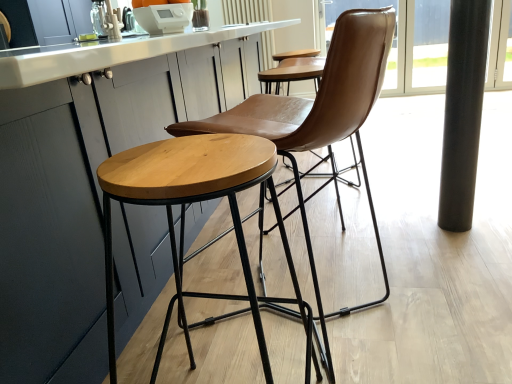
Question: Does brown leather chair at center come behind black polished pole at right?

Choices:
 (A) no
 (B) yes

Answer: (A)

Question: Does brown leather chair at center have a greater height compared to black polished pole at right?

Choices:
 (A) no
 (B) yes

Answer: (A)

Question: Does brown leather chair at center have a smaller size compared to black polished pole at right?

Choices:
 (A) no
 (B) yes

Answer: (A)

Question: Does brown leather chair at center have a larger size compared to black polished pole at right?

Choices:
 (A) yes
 (B) no

Answer: (A)

Question: From the image's perspective, is brown leather chair at center located beneath black polished pole at right?

Choices:
 (A) yes
 (B) no

Answer: (A)

Question: Is brown leather chair at center wider than black polished pole at right?

Choices:
 (A) yes
 (B) no

Answer: (A)

Question: Is white glossy countertop at center facing towards black polished pole at right?

Choices:
 (A) no
 (B) yes

Answer: (B)

Question: Is black polished pole at right a part of white glossy countertop at center?

Choices:
 (A) yes
 (B) no

Answer: (B)

Question: Can you confirm if white glossy countertop at center is shorter than black polished pole at right?

Choices:
 (A) yes
 (B) no

Answer: (A)

Question: From the image's perspective, is white glossy countertop at center on black polished pole at right?

Choices:
 (A) no
 (B) yes

Answer: (B)

Question: Would you say white glossy countertop at center is outside black polished pole at right?

Choices:
 (A) no
 (B) yes

Answer: (B)

Question: Does white glossy countertop at center come behind black polished pole at right?

Choices:
 (A) no
 (B) yes

Answer: (A)

Question: Is brown leather chair at center wider than white glossy countertop at center?

Choices:
 (A) yes
 (B) no

Answer: (B)